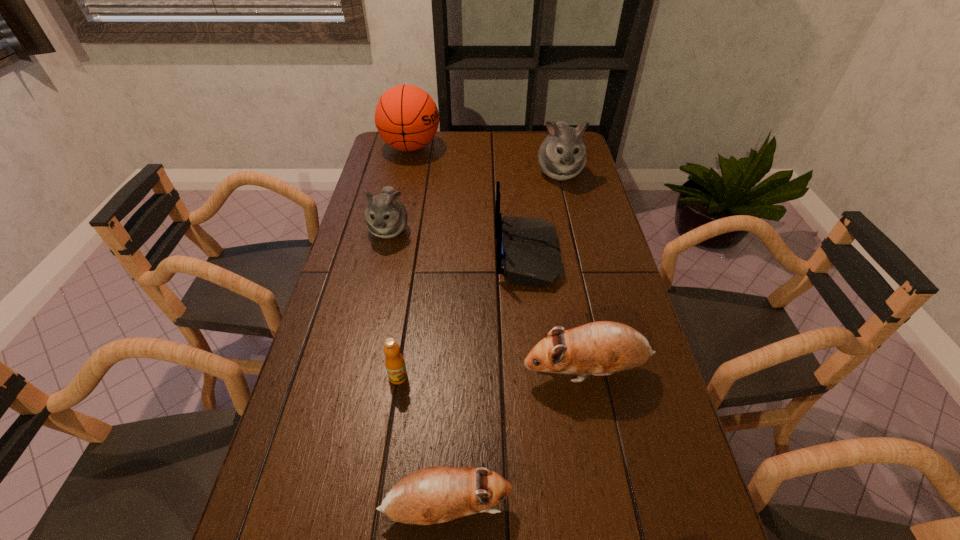
The height and width of the screenshot is (540, 960). In the image, there is a desktop. What are the coordinates of `vacant space at the right edge` in the screenshot? It's located at (549, 194).

Identify the location of vacant space at the far left corner of the desktop. The image size is (960, 540). (412, 161).

Where is `free area in between the smaller brown hamster and the basketball`? The height and width of the screenshot is (540, 960). free area in between the smaller brown hamster and the basketball is located at coordinates (428, 329).

At what (x,y) coordinates should I click in order to perform the action: click on free space between the basketball and the router. Please return your answer as a coordinate pair (x, y). Looking at the image, I should click on (469, 202).

Identify the location of unoccupied area between the leftmost hamster and the third hamster from right to left. (418, 370).

Locate an element on the screen. free space between the router and the left white hamster is located at coordinates (458, 242).

At what (x,y) coordinates should I click in order to perform the action: click on free area in between the farthest hamster and the nearest object. Please return your answer as a coordinate pair (x, y). Looking at the image, I should click on pos(503,341).

Locate an element on the screen. This screenshot has height=540, width=960. free space between the black router and the smaller brown hamster is located at coordinates (487, 383).

Identify the location of free spot between the basketball and the shortest hamster. (428, 329).

Locate an element on the screen. The image size is (960, 540). vacant space that's between the shortest hamster and the farther brown hamster is located at coordinates (516, 441).